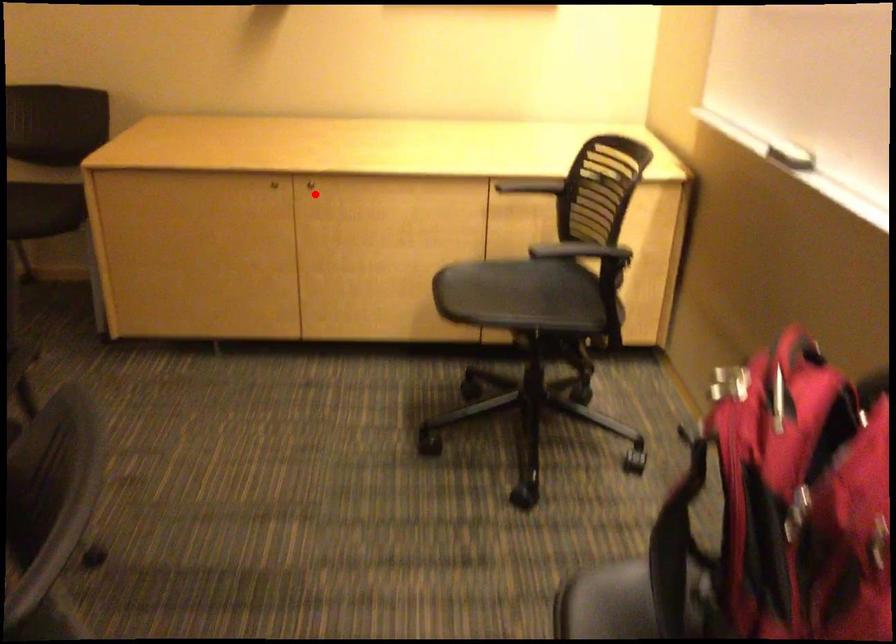
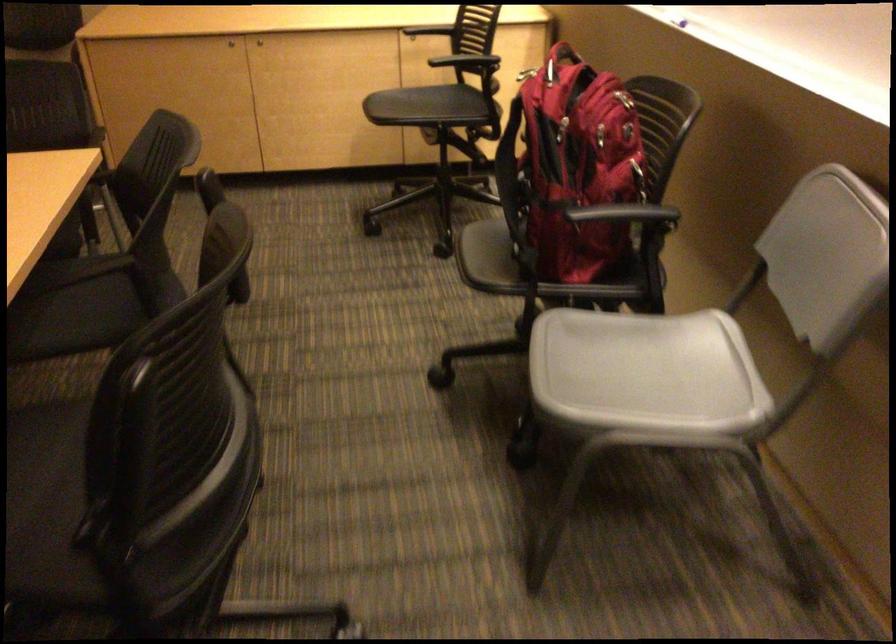
Locate, in the second image, the point that corresponds to the highlighted location in the first image.

(259, 41)